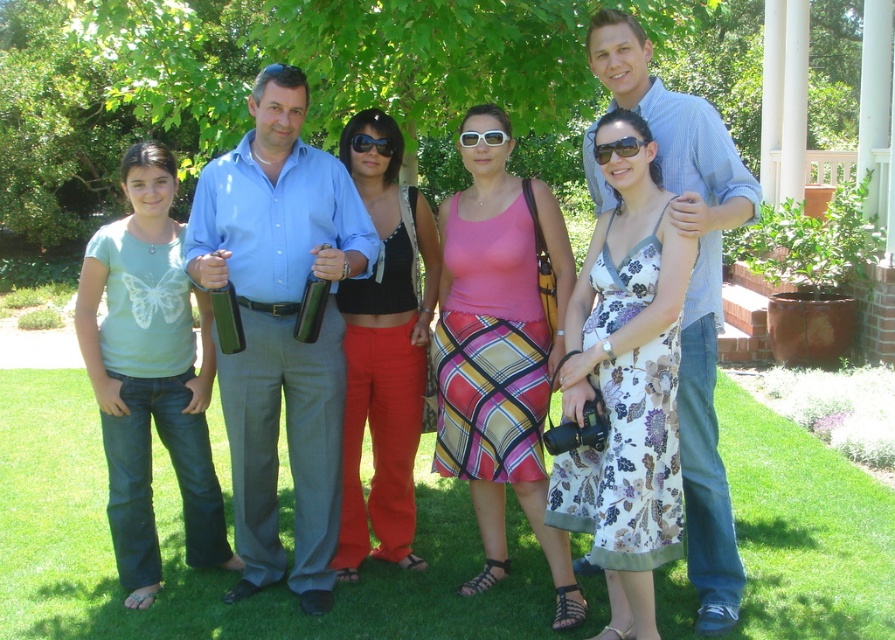
Question: Estimate the real-world distances between objects in this image. Which object is closer to the white plastic sunglasses at center?

Choices:
 (A) blue striped shirt at center
 (B) pink matte tank top at center
 (C) black satin tank top at center

Answer: (B)

Question: In this image, where is matte black sunglasses at center located relative to black plastic sunglasses at center?

Choices:
 (A) left
 (B) right

Answer: (B)

Question: Which object appears farthest from the camera in this image?

Choices:
 (A) blue striped shirt at center
 (B) green grass at lower center

Answer: (B)

Question: Is green grass at lower center thinner than blue striped shirt at center?

Choices:
 (A) yes
 (B) no

Answer: (A)

Question: Which is nearer to the matte black sunglasses at center?

Choices:
 (A) black plastic sunglasses at center
 (B) white plastic sunglasses at center
 (C) green grass at lower center

Answer: (B)

Question: Is blue striped shirt at center bigger than black plastic sunglasses at center?

Choices:
 (A) yes
 (B) no

Answer: (A)